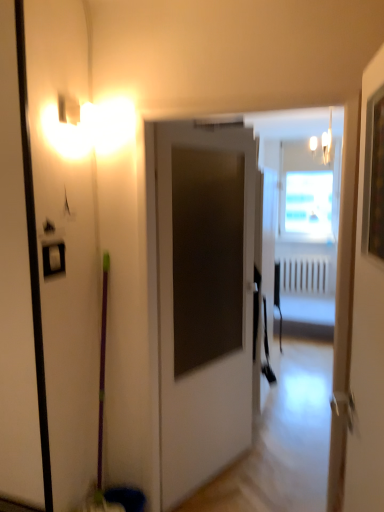
Question: Is white plastic radiator at center looking in the opposite direction of white glossy door at upper right, which is counted as the 2th door, starting from the back?

Choices:
 (A) no
 (B) yes

Answer: (A)

Question: Is white glossy door at upper right, which is counted as the 2th door, starting from the back, located within white plastic radiator at center?

Choices:
 (A) yes
 (B) no

Answer: (B)

Question: Is white plastic radiator at center wider than white glossy door at upper right, the first door positioned from the front?

Choices:
 (A) yes
 (B) no

Answer: (A)

Question: Is white plastic radiator at center positioned before white glossy door at upper right, which is counted as the 2th door, starting from the back?

Choices:
 (A) yes
 (B) no

Answer: (B)

Question: Considering the relative sizes of white plastic radiator at center and white glossy door at upper right, which is counted as the 2th door, starting from the back, in the image provided, is white plastic radiator at center taller than white glossy door at upper right, which is counted as the 2th door, starting from the back,?

Choices:
 (A) no
 (B) yes

Answer: (A)

Question: Is white plastic radiator at center outside white glossy door at upper right, the first door positioned from the front?

Choices:
 (A) no
 (B) yes

Answer: (B)

Question: Can you confirm if white glossy door at upper right, which is counted as the 2th door, starting from the back, is taller than white plastic radiator at center?

Choices:
 (A) yes
 (B) no

Answer: (A)

Question: Are white glossy door at upper right, the first door positioned from the front, and white plastic radiator at center located far from each other?

Choices:
 (A) yes
 (B) no

Answer: (A)

Question: From a real-world perspective, is white glossy door at upper right, the first door positioned from the front, located beneath white plastic radiator at center?

Choices:
 (A) yes
 (B) no

Answer: (B)

Question: Is white glossy door at upper right, which is counted as the 2th door, starting from the back, touching white plastic radiator at center?

Choices:
 (A) no
 (B) yes

Answer: (A)

Question: Can you confirm if white glossy door at upper right, the first door positioned from the front, is bigger than white plastic radiator at center?

Choices:
 (A) yes
 (B) no

Answer: (A)

Question: Is white glossy door at upper right, the first door positioned from the front, looking in the opposite direction of white plastic radiator at center?

Choices:
 (A) no
 (B) yes

Answer: (A)

Question: Considering the relative sizes of white matte door at center, marked as the 1th door in a back-to-front arrangement, and white plastic radiator at center in the image provided, is white matte door at center, marked as the 1th door in a back-to-front arrangement, smaller than white plastic radiator at center?

Choices:
 (A) yes
 (B) no

Answer: (B)